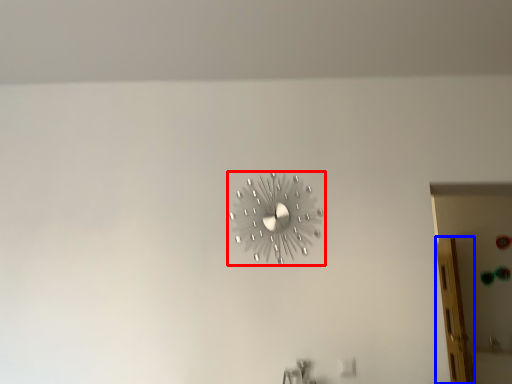
Question: Among these objects, which one is nearest to the camera, wall clock (highlighted by a red box) or glass door (highlighted by a blue box)?

Choices:
 (A) wall clock
 (B) glass door

Answer: (A)